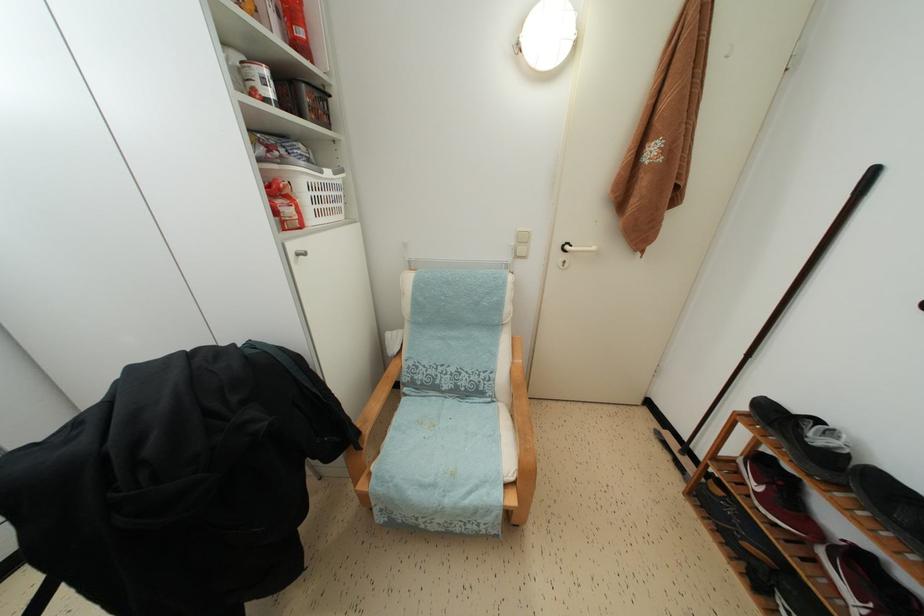
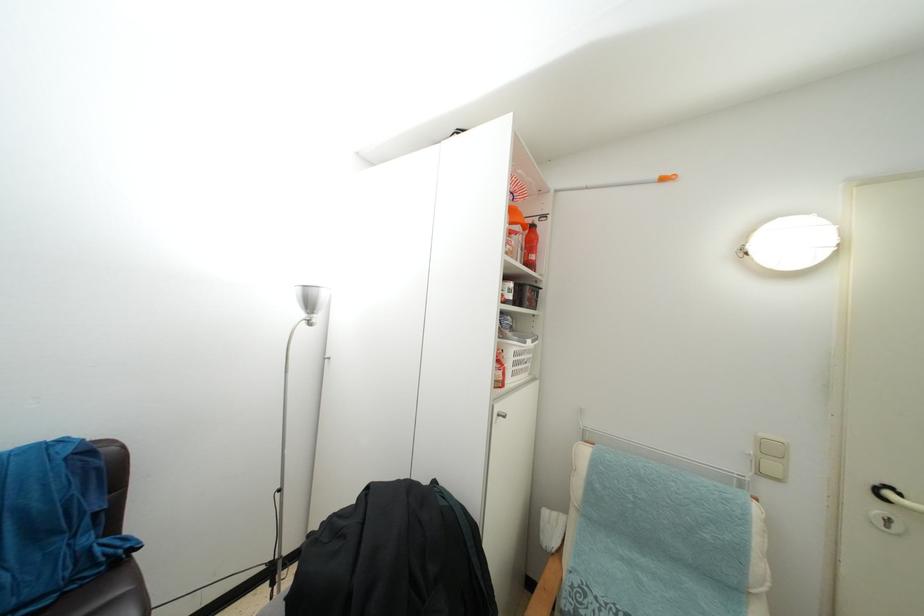
Locate, in the second image, the point that corresponds to the point at 526,256 in the first image.

(775, 472)